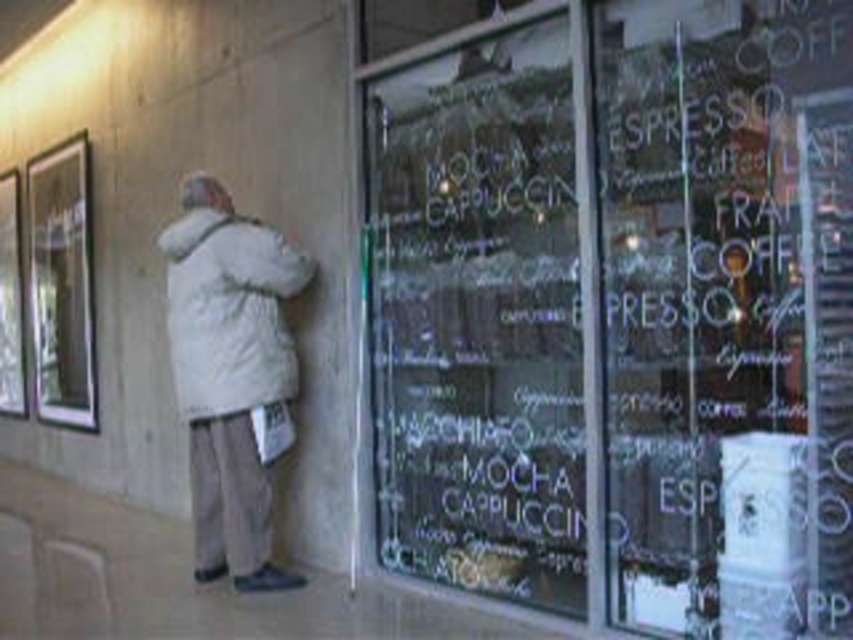
Question: Which point is farther to the camera?

Choices:
 (A) (299, 276)
 (B) (288, 296)
 (C) (21, 285)
 (D) (683, 179)

Answer: (C)

Question: Is white matte coat at center wider than white cotton coat at center?

Choices:
 (A) yes
 (B) no

Answer: (A)

Question: Which object appears closest to the camera in this image?

Choices:
 (A) white chalkboard at center
 (B) white matte coat at center

Answer: (A)

Question: Which object is positioned farthest from the white chalkboard at center?

Choices:
 (A) clear glass window at upper left
 (B) white cotton coat at center
 (C) white matte coat at center
 (D) transparent glass window at upper left

Answer: (D)

Question: Is white matte coat at center below clear glass window at upper left?

Choices:
 (A) yes
 (B) no

Answer: (A)

Question: Does white chalkboard at center appear under transparent glass window at upper left?

Choices:
 (A) yes
 (B) no

Answer: (B)